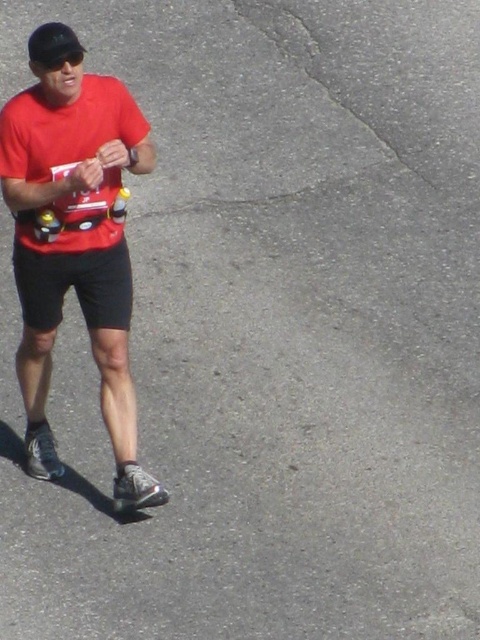
Question: Which of the following is the farthest from the observer?

Choices:
 (A) (69, 54)
 (B) (126, 248)

Answer: (B)

Question: Does matte red shirt at left have a smaller size compared to black cotton shorts at center?

Choices:
 (A) no
 (B) yes

Answer: (A)

Question: Based on their relative distances, which object is farther from the black matte baseball hat at upper left?

Choices:
 (A) matte red shirt at left
 (B) black cotton shorts at center

Answer: (B)

Question: Can you confirm if matte red shirt at left is positioned to the right of black cotton shorts at center?

Choices:
 (A) yes
 (B) no

Answer: (A)

Question: Which point appears closest to the camera in this image?

Choices:
 (A) (39, 60)
 (B) (48, 96)

Answer: (A)

Question: Does matte red shirt at left lie in front of black matte baseball hat at upper left?

Choices:
 (A) yes
 (B) no

Answer: (B)